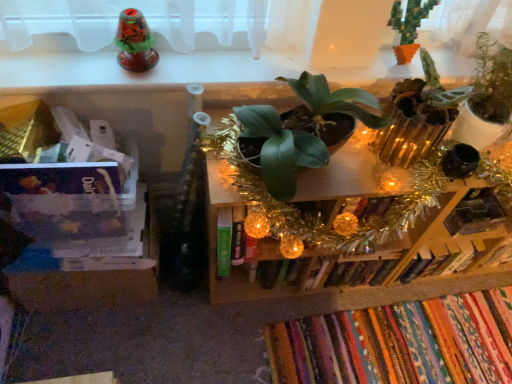
Locate an element on the screen. This screenshot has width=512, height=384. vacant area that is situated to the right of hardcover book at center-right, the 1th book viewed from the top is located at coordinates (472, 291).